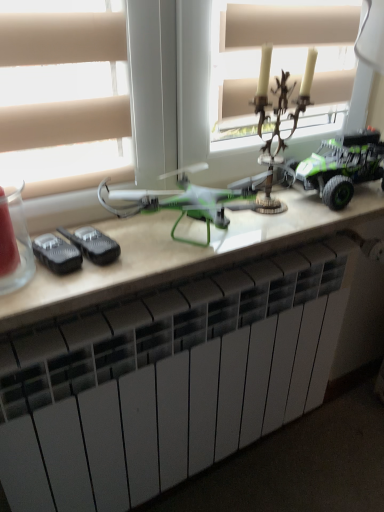
Question: Considering their positions, is antique bronze candlestick at upper center, which is the first toy in left-to-right order, located in front of or behind green plastic drone at center?

Choices:
 (A) behind
 (B) front

Answer: (A)

Question: Would you say antique bronze candlestick at upper center, the 2th toy positioned from the right, is inside or outside green plastic drone at center?

Choices:
 (A) outside
 (B) inside

Answer: (A)

Question: Which object is positioned farthest from the green matte toy truck at right, the 1th toy viewed from the right?

Choices:
 (A) green plastic drone at center
 (B) white matte radiator at lower center
 (C) antique bronze candlestick at upper center, the 2th toy positioned from the right

Answer: (B)

Question: Which object is the farthest from the green matte toy truck at right, marked as the 2th toy in a left-to-right arrangement?

Choices:
 (A) antique bronze candlestick at upper center, the 2th toy positioned from the right
 (B) green plastic drone at center
 (C) white matte radiator at lower center

Answer: (C)